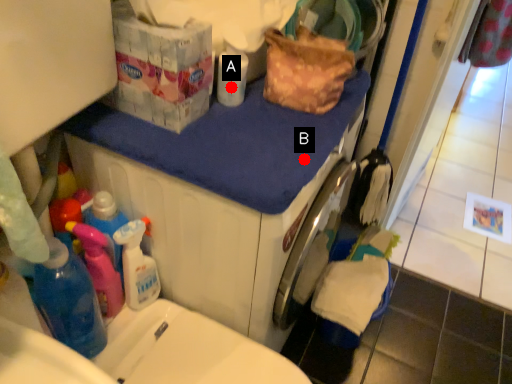
Question: Two points are circled on the image, labeled by A and B beside each circle. Among these points, which one is nearest to the camera?

Choices:
 (A) A is closer
 (B) B is closer

Answer: (B)